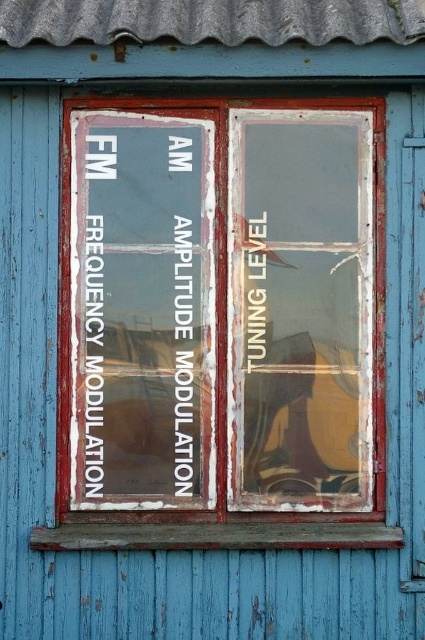
Does chipped paint window at center have a larger size compared to transparent glass guitar at right?

Yes.

Consider the image. Between chipped paint window at center and transparent glass guitar at right, which one appears on the left side from the viewer's perspective?

From the viewer's perspective, chipped paint window at center appears more on the left side.

Which is in front, point (348, 141) or point (331, 314)?

Point (331, 314)

Identify the location of chipped paint window at center. (223, 307).